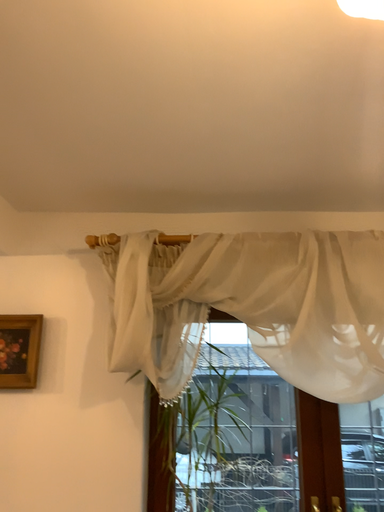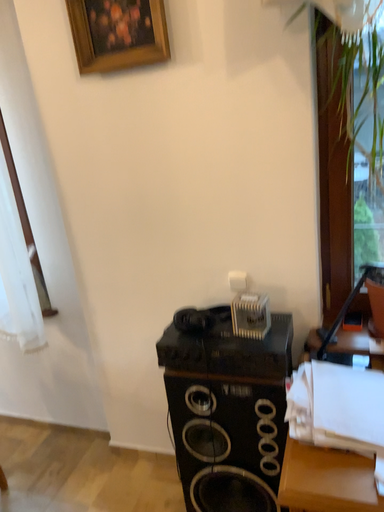
Question: How did the camera likely rotate when shooting the video?

Choices:
 (A) rotated left
 (B) rotated right

Answer: (A)